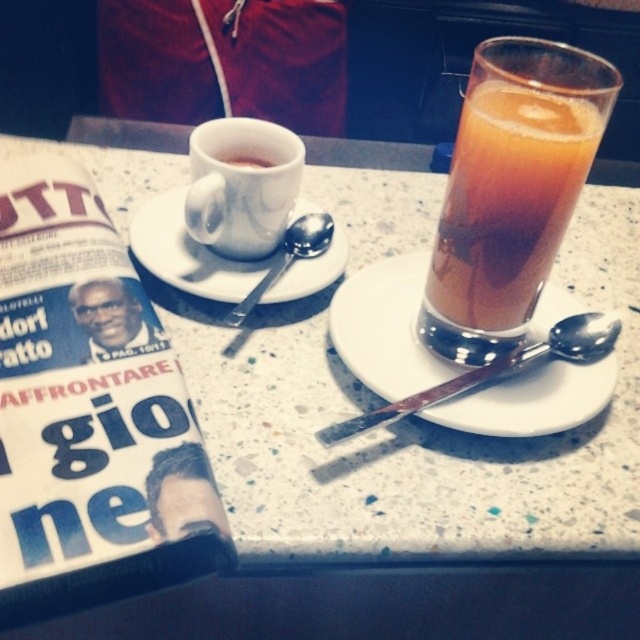
Is translucent glass beverage at upper right further to camera compared to white glossy cup at center?

That is False.

Does translucent glass beverage at upper right appear over white glossy cup at center?

Actually, translucent glass beverage at upper right is below white glossy cup at center.

Which is in front, point (532, 148) or point (224, 243)?

Positioned in front is point (532, 148).

Identify the location of translucent glass beverage at upper right. The image size is (640, 640). (509, 189).

Does white glossy cup at center have a larger size compared to matte white cup at upper center?

Yes, white glossy cup at center is bigger than matte white cup at upper center.

I want to click on white glossy cup at center, so click(x=241, y=186).

I want to click on white glossy cup at center, so click(x=241, y=186).

Does translucent glass beverage at upper right have a lesser width compared to matte white cup at upper center?

In fact, translucent glass beverage at upper right might be wider than matte white cup at upper center.

The height and width of the screenshot is (640, 640). What do you see at coordinates (509, 189) in the screenshot?
I see `translucent glass beverage at upper right` at bounding box center [509, 189].

Between point (552, 61) and point (244, 164), which one is positioned in front?

Point (552, 61) is more forward.

This screenshot has height=640, width=640. What are the coordinates of `translucent glass beverage at upper right` in the screenshot? It's located at (509, 189).